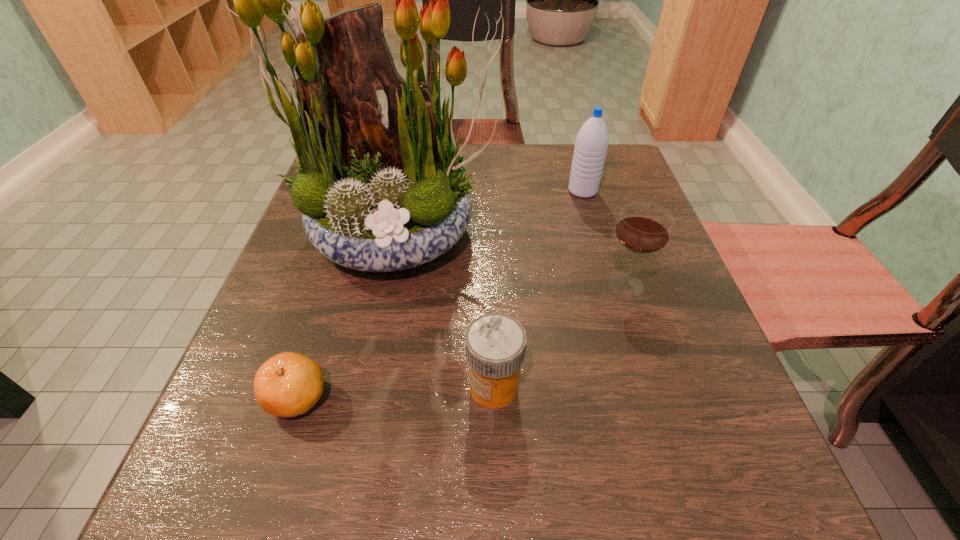
You are a GUI agent. You are given a task and a screenshot of the screen. Output one action in this format:
    pyautogui.click(x=<x>, y=<y>)
    Task: Click on the vacant space located 0.270m on the label side of the medicine
    This screenshot has height=540, width=960.
    Given the screenshot: What is the action you would take?
    pyautogui.click(x=283, y=387)

I want to click on free space located 0.120m on the front of the shortest object, so click(x=256, y=522).

Where is `flower arrangement that is at the far edge`? This screenshot has height=540, width=960. flower arrangement that is at the far edge is located at coordinates (377, 196).

The image size is (960, 540). In order to click on water bottle located at the far edge in this screenshot , I will do `click(591, 144)`.

Locate an element on the screen. This screenshot has height=540, width=960. flower arrangement at the left edge is located at coordinates (377, 196).

At what (x,y) coordinates should I click in order to perform the action: click on clementine located at the left edge. Please return your answer as a coordinate pair (x, y). Looking at the image, I should click on (289, 384).

Locate an element on the screen. This screenshot has width=960, height=540. water bottle that is at the right edge is located at coordinates (591, 144).

Where is `wineglass located at the right edge`? Image resolution: width=960 pixels, height=540 pixels. wineglass located at the right edge is located at coordinates (644, 228).

Where is `object that is at the far left corner`? The width and height of the screenshot is (960, 540). object that is at the far left corner is located at coordinates (377, 196).

Find the location of a particular element. This screenshot has width=960, height=540. object present at the far right corner is located at coordinates (591, 144).